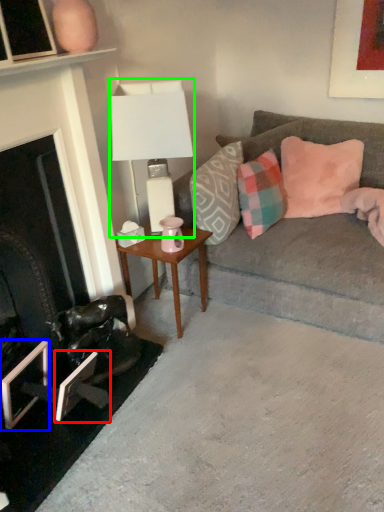
Question: Which object is positioned closest to picture frame (highlighted by a red box)? Select from picture frame (highlighted by a blue box) and table lamp (highlighted by a green box).

Choices:
 (A) picture frame
 (B) table lamp

Answer: (A)